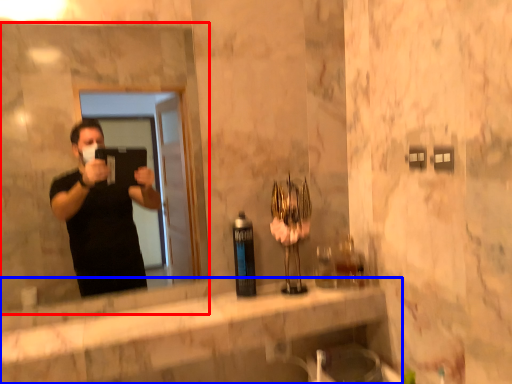
Question: Which point is further to the camera, mirror (highlighted by a red box) or counter top (highlighted by a blue box)?

Choices:
 (A) mirror
 (B) counter top

Answer: (A)